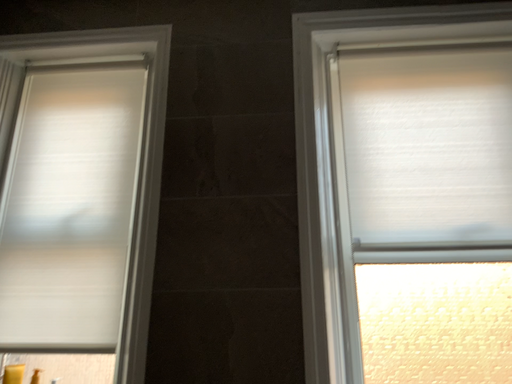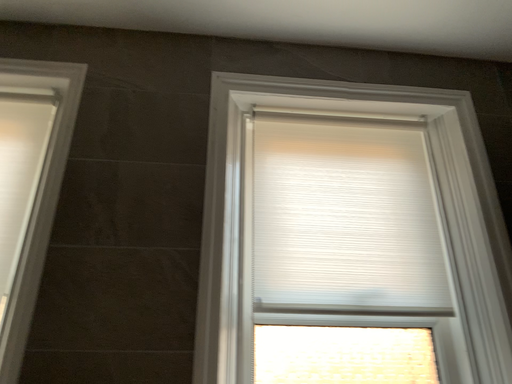
Question: Which way did the camera rotate in the video?

Choices:
 (A) rotated right
 (B) rotated left

Answer: (A)